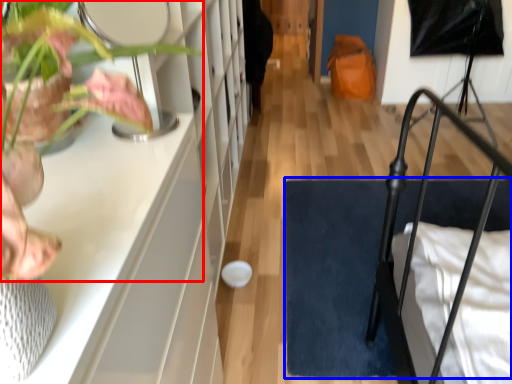
Question: Which point is further to the camera, houseplant (highlighted by a red box) or doormat (highlighted by a blue box)?

Choices:
 (A) houseplant
 (B) doormat

Answer: (B)